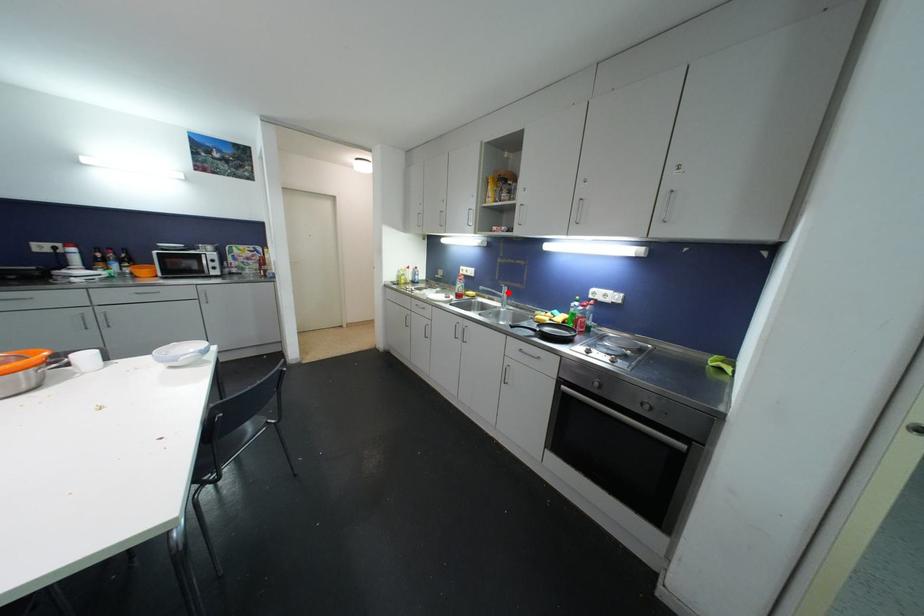
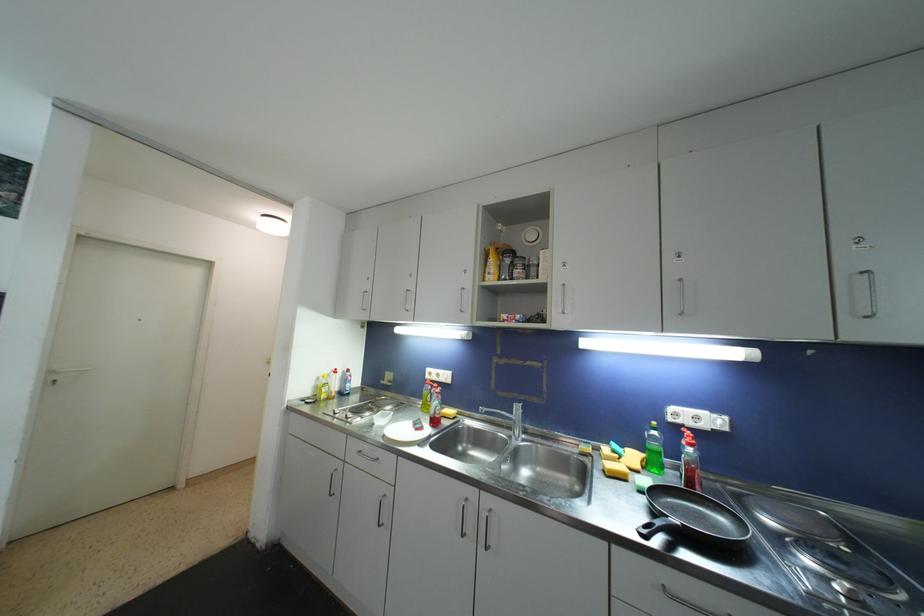
Where in the second image is the point corresponding to the highlighted location from the first image?

(520, 411)